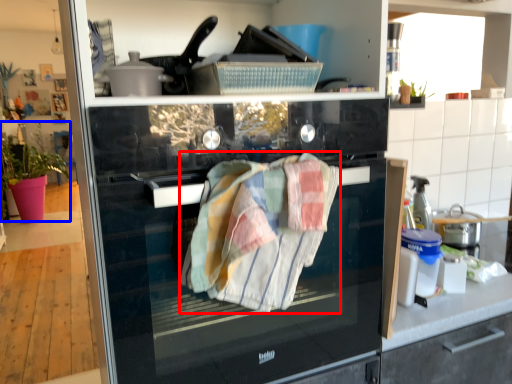
Question: Which object is further to the camera taking this photo, bath towel (highlighted by a red box) or plant (highlighted by a blue box)?

Choices:
 (A) bath towel
 (B) plant

Answer: (B)